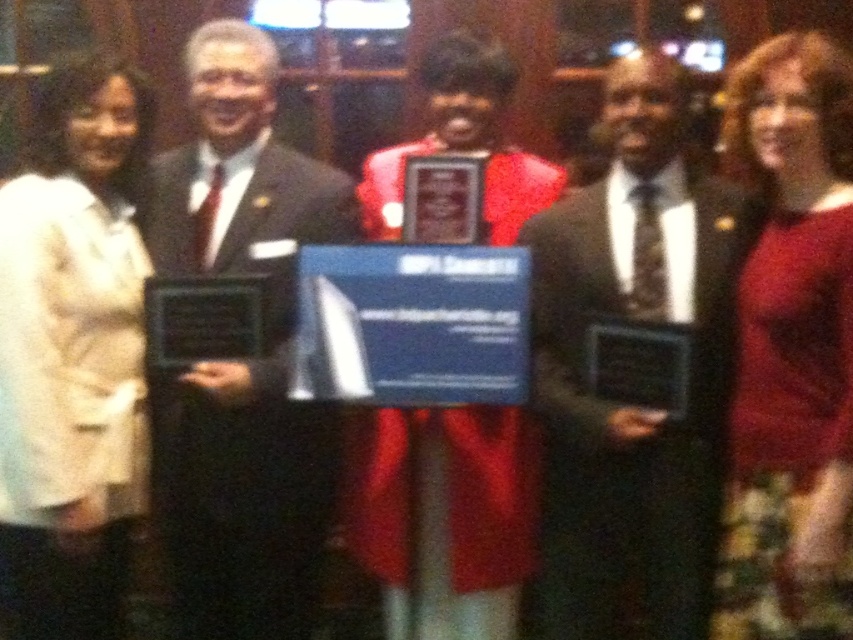
Question: Is shiny black suit at center above white fabric coat at left?

Choices:
 (A) no
 (B) yes

Answer: (B)

Question: Is white fabric coat at left bigger than matte black suit at center?

Choices:
 (A) no
 (B) yes

Answer: (A)

Question: Among these points, which one is nearest to the camera?

Choices:
 (A) (834, 586)
 (B) (642, 449)
 (C) (39, 522)
 (D) (165, 518)

Answer: (A)

Question: Is shiny black suit at center thinner than matte black suit at center?

Choices:
 (A) no
 (B) yes

Answer: (A)

Question: Which of the following is the farthest from the observer?

Choices:
 (A) (631, 154)
 (B) (750, 129)
 (C) (316, 420)
 (D) (90, 262)

Answer: (C)

Question: Which point is farther from the camera taking this photo?

Choices:
 (A) (68, 480)
 (B) (750, 520)
 (C) (326, 529)
 (D) (611, 490)

Answer: (C)